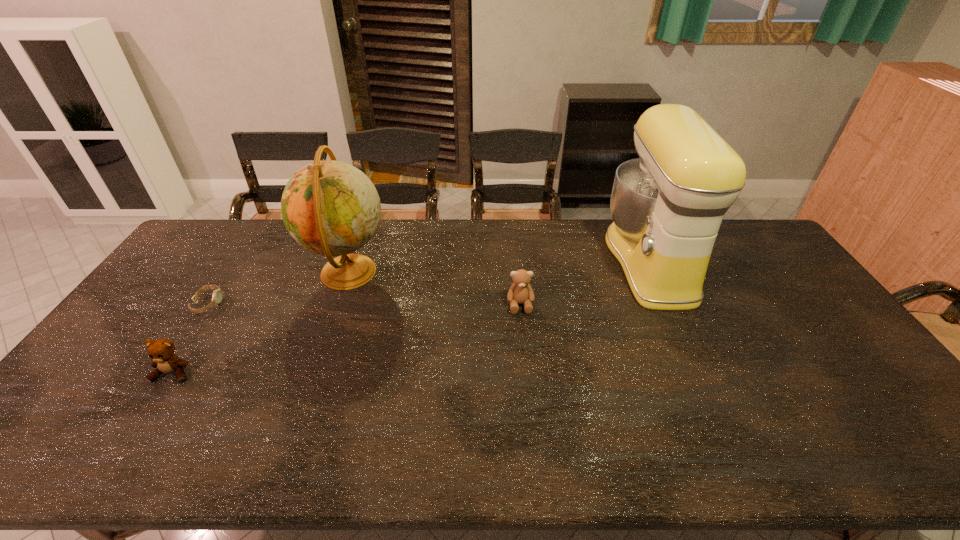
You are a GUI agent. You are given a task and a screenshot of the screen. Output one action in this format:
    pyautogui.click(x=<x>, y=<y>)
    Task: Click on the free space between the globe and the left teddy bear
    
    Given the screenshot: What is the action you would take?
    pyautogui.click(x=261, y=322)

Where is `object that is the closest to the mixer`? object that is the closest to the mixer is located at coordinates (520, 292).

Choose which object is the second nearest neighbor to the third object from right to left. Please provide its 2D coordinates. Your answer should be formatted as a tuple, i.e. [(x, y)], where the tuple contains the x and y coordinates of a point satisfying the conditions above.

[(161, 351)]

Locate an element on the screen. This screenshot has height=540, width=960. vacant area in the image that satisfies the following two spatial constraints: 1. on the side of the rightmost object with the control knob; 2. on the front-facing side of the nearer teddy bear is located at coordinates (701, 373).

The width and height of the screenshot is (960, 540). What are the coordinates of `vacant space that satisfies the following two spatial constraints: 1. on the side of the rightmost object with the control knob; 2. on the front-facing side of the fourth object from left to right` in the screenshot? It's located at coord(669,305).

Where is `vacant space that satisfies the following two spatial constraints: 1. on the side of the mixer with the control knob; 2. on the front-facing side of the farther teddy bear`? vacant space that satisfies the following two spatial constraints: 1. on the side of the mixer with the control knob; 2. on the front-facing side of the farther teddy bear is located at coordinates 669,305.

This screenshot has height=540, width=960. I want to click on free location that satisfies the following two spatial constraints: 1. on the side of the rightmost object with the control knob; 2. on the front side of the third object from left to right, so click(x=655, y=272).

This screenshot has height=540, width=960. Find the location of `vacant space that satisfies the following two spatial constraints: 1. on the front side of the third object from right to left; 2. on the face of the watch`. vacant space that satisfies the following two spatial constraints: 1. on the front side of the third object from right to left; 2. on the face of the watch is located at coordinates (338, 303).